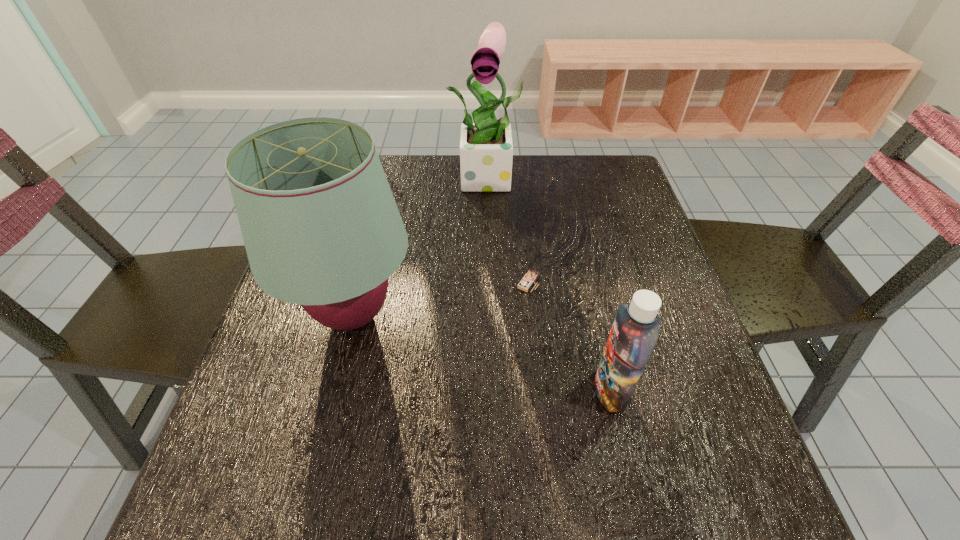
The width and height of the screenshot is (960, 540). Identify the location of vacant region located 0.280m on the left of the matchbox. (392, 282).

Image resolution: width=960 pixels, height=540 pixels. Find the location of `object positioned at the far edge`. object positioned at the far edge is located at coordinates (486, 149).

The height and width of the screenshot is (540, 960). What are the coordinates of `object that is positioned at the left edge` in the screenshot? It's located at (321, 228).

You are a GUI agent. You are given a task and a screenshot of the screen. Output one action in this format:
    pyautogui.click(x=<x>, y=<y>)
    Task: Click on the vacant space at the far edge
    This screenshot has width=960, height=540.
    Given the screenshot: What is the action you would take?
    pyautogui.click(x=513, y=184)

In the image, there is a desktop. Identify the location of vacant space at the near edge. (316, 528).

Find the location of `vacant space at the left edge of the desktop`. vacant space at the left edge of the desktop is located at coordinates (238, 427).

The width and height of the screenshot is (960, 540). I want to click on free space at the right edge of the desktop, so click(x=740, y=437).

Locate an element on the screen. free region at the far right corner of the desktop is located at coordinates (589, 184).

Locate an element on the screen. vacant space that's between the third tallest object and the shortest object is located at coordinates (569, 336).

The height and width of the screenshot is (540, 960). Identify the location of vacant region between the matchbox and the flower arrangement. (510, 230).